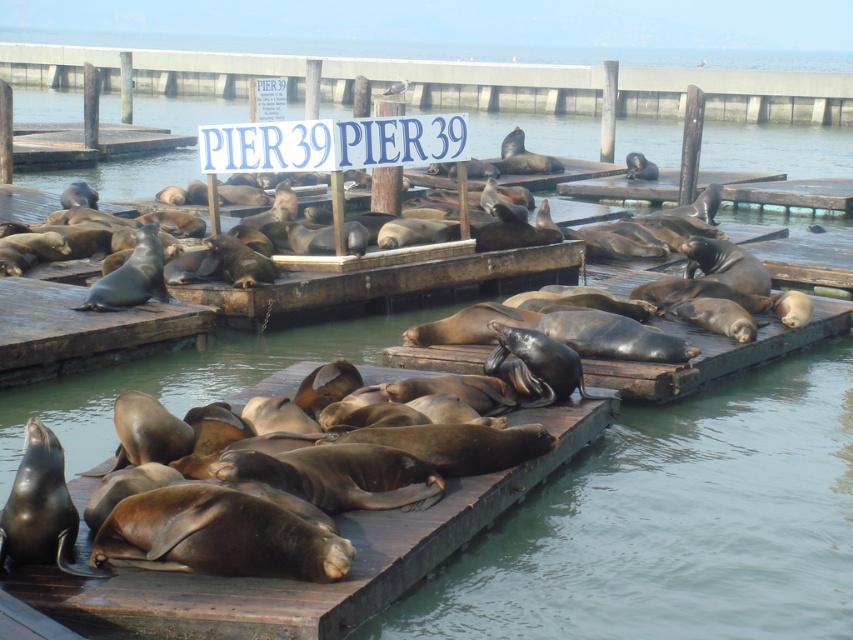
You are standing on the brown matte dock at lower left and want to see the blue plastic sign at upper center. Is the sign visible to you without moving your head?

The brown matte dock at lower left is in front of the blue plastic sign at upper center, so the sign is partially or fully blocked by the dock. You might not be able to see it clearly without moving your head.

Based on the coordinates provided, where is the brown matte dock at lower left located in the image?

The brown matte dock at lower left is located at coordinates point (312, 582).